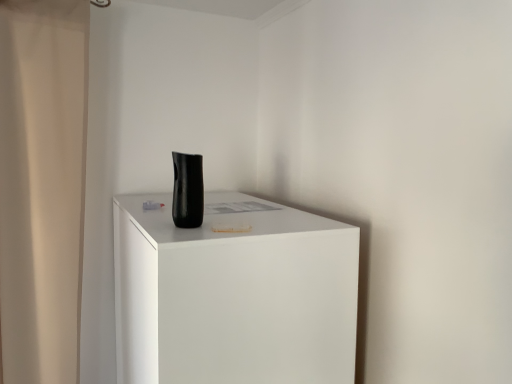
This screenshot has width=512, height=384. I want to click on blank space situated above matte black vase at center (from a real-world perspective), so click(241, 213).